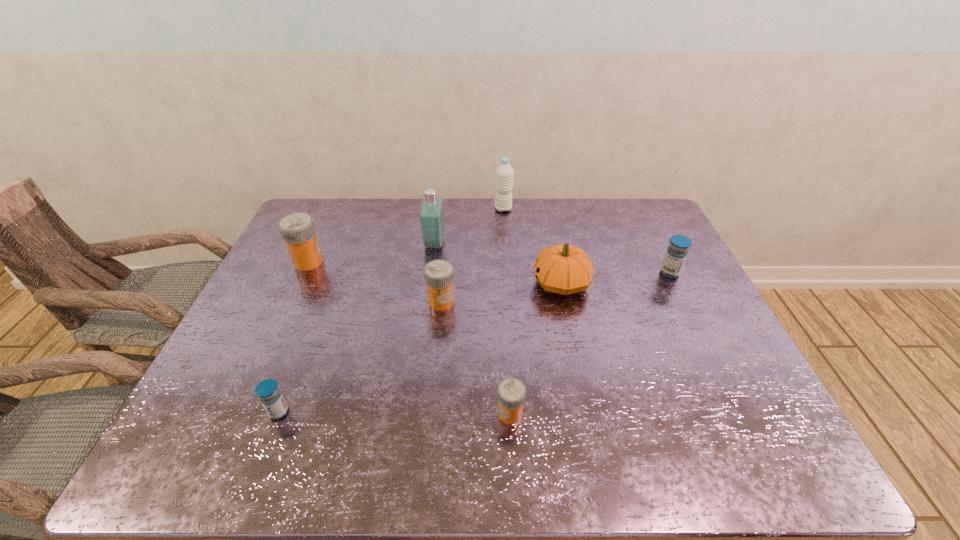
Where is `blank region between the second object from left to right and the second smallest orange medicine`? This screenshot has width=960, height=540. blank region between the second object from left to right and the second smallest orange medicine is located at coordinates (360, 357).

Locate an element on the screen. vacant area that lies between the fourth medicine from right to left and the second smallest orange medicine is located at coordinates (360, 357).

The image size is (960, 540). I want to click on empty location between the water bottle and the orange gourd, so click(x=532, y=246).

Where is `free spot between the perfume and the rightmost orange medicine`? free spot between the perfume and the rightmost orange medicine is located at coordinates (472, 329).

In order to click on empty space that is in between the nearest orange medicine and the perfume in this screenshot , I will do click(472, 329).

Locate an element on the screen. The image size is (960, 540). object that is the seventh closest to the orange gourd is located at coordinates (268, 392).

The height and width of the screenshot is (540, 960). Find the location of `the fifth closest object to the nearest orange medicine`. the fifth closest object to the nearest orange medicine is located at coordinates [x=676, y=253].

Find the location of `medicine that stands as the third closest to the rightmost object`. medicine that stands as the third closest to the rightmost object is located at coordinates (297, 230).

Locate which medicine ranks fourth in proximity to the smallest orange medicine. Please provide its 2D coordinates. Your answer should be formatted as a tuple, i.e. [(x, y)], where the tuple contains the x and y coordinates of a point satisfying the conditions above.

[(297, 230)]

Select which orange medicine appears as the second closest to the bigger blue medicine. Please provide its 2D coordinates. Your answer should be formatted as a tuple, i.e. [(x, y)], where the tuple contains the x and y coordinates of a point satisfying the conditions above.

[(439, 274)]